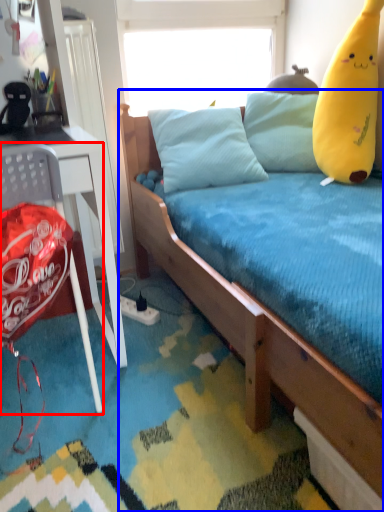
Question: Which point is closer to the camera, chair (highlighted by a red box) or bed (highlighted by a blue box)?

Choices:
 (A) chair
 (B) bed

Answer: (B)